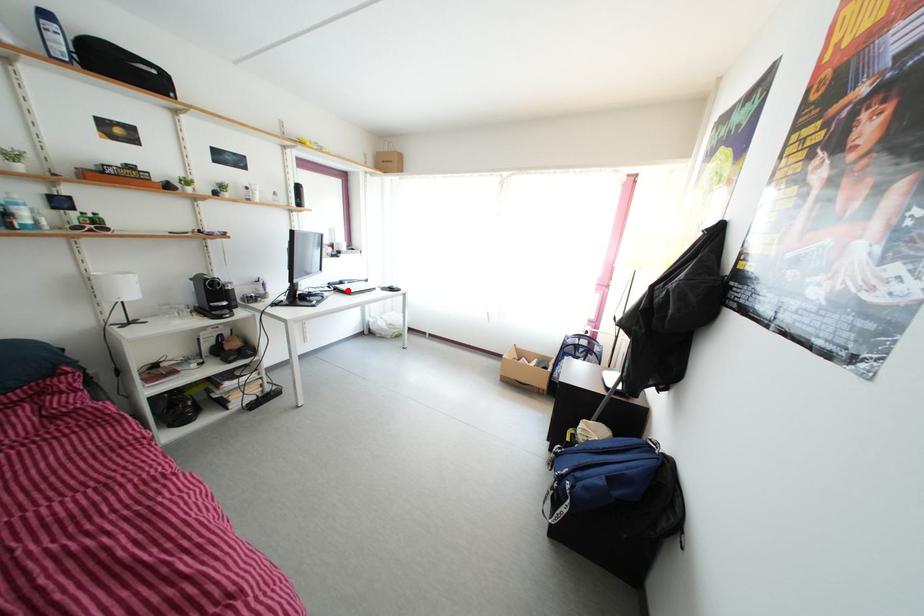
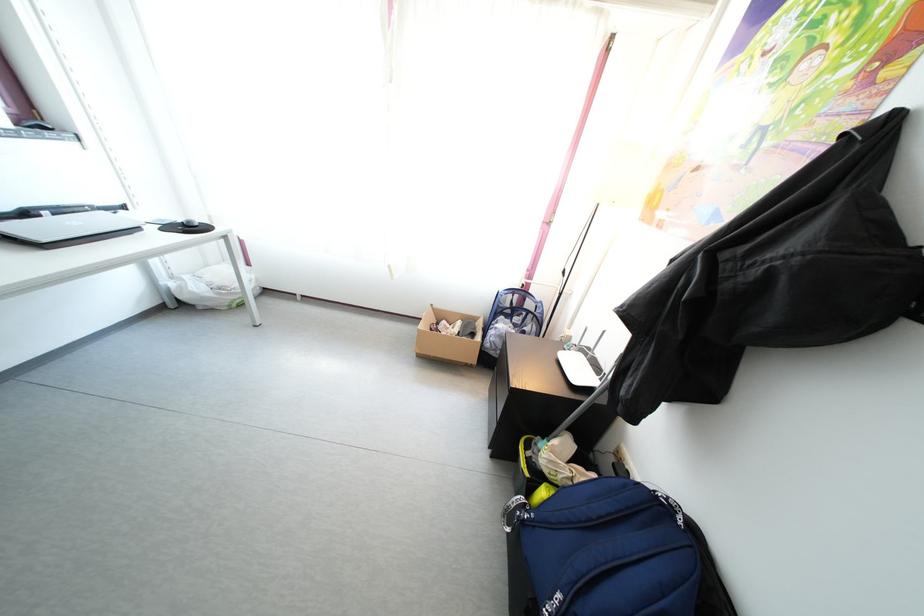
The point at the highlighted location is marked in the first image. Where is the corresponding point in the second image?

(31, 222)